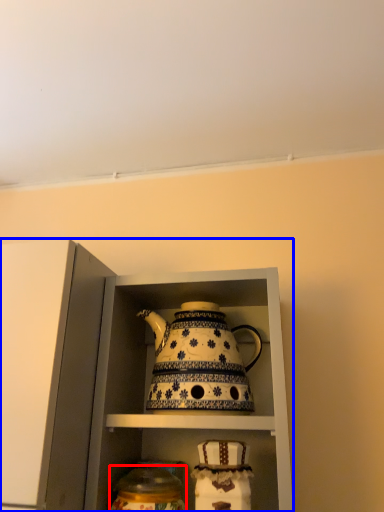
Question: Which object appears farthest to the camera in this image, tableware (highlighted by a red box) or cabinetry (highlighted by a blue box)?

Choices:
 (A) tableware
 (B) cabinetry

Answer: (A)